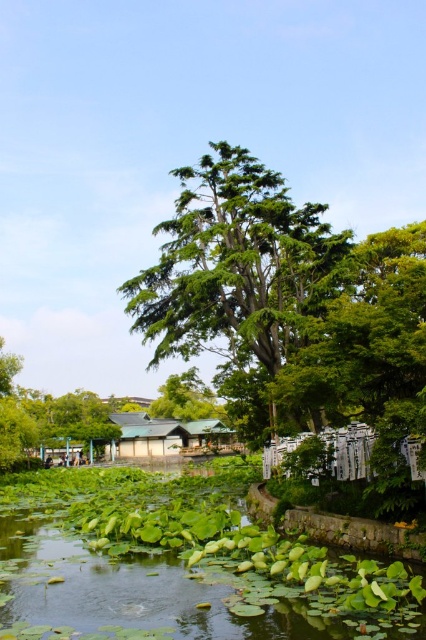
You are standing in the scene and want to determine which of the two points, point (112, 605) or point (331, 304), is nearer to you. Based on the image, which point is closer?

Point (112, 605) is closer to the camera than point (331, 304), so it is the nearer one.

Looking at this image, you are standing in the scene and see the green leafy water at lower left and the green matte hut at center. Which object is closer to your right side?

The green leafy water at lower left is positioned on the right side of green matte hut at center, so it is closer to your right side.

You are a bird flying over the serene natural scene. You want to land on the closest green leafy area to rest. Which one should you choose between the green leafy water at lower left and the green leafy tree at right?

The green leafy water at lower left is in front of the green leafy tree at right, so it is closer to you. Therefore, you should choose the green leafy water at lower left to land on.